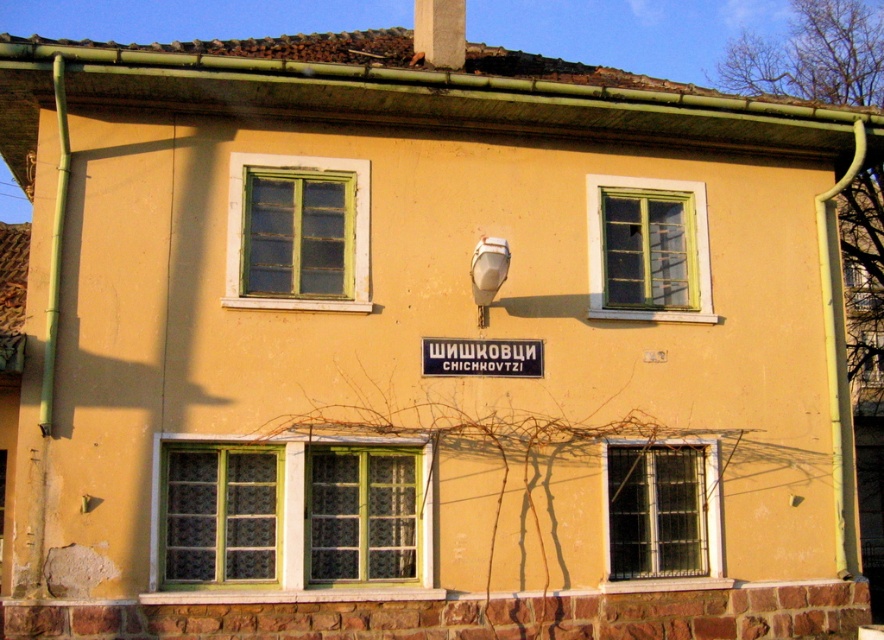
Question: Is green textured glass window at lower center above green painted wood window at upper center?

Choices:
 (A) no
 (B) yes

Answer: (A)

Question: Among these points, which one is nearest to the camera?

Choices:
 (A) (264, 180)
 (B) (626, 304)
 (C) (343, 467)

Answer: (C)

Question: Which point is closer to the camera taking this photo?

Choices:
 (A) (696, 218)
 (B) (450, 362)
 (C) (692, 573)
 (D) (242, 154)

Answer: (D)

Question: Which of the following is the farthest from the observer?

Choices:
 (A) clear glass window at center
 (B) green textured glass window at lower center
 (C) green painted wood window at upper center

Answer: (A)

Question: Is the position of green textured glass window at lower center more distant than that of black plastic sign at center?

Choices:
 (A) no
 (B) yes

Answer: (A)

Question: Observing the image, what is the correct spatial positioning of green textured glass window at lower center in reference to black plastic sign at center?

Choices:
 (A) above
 (B) below

Answer: (B)